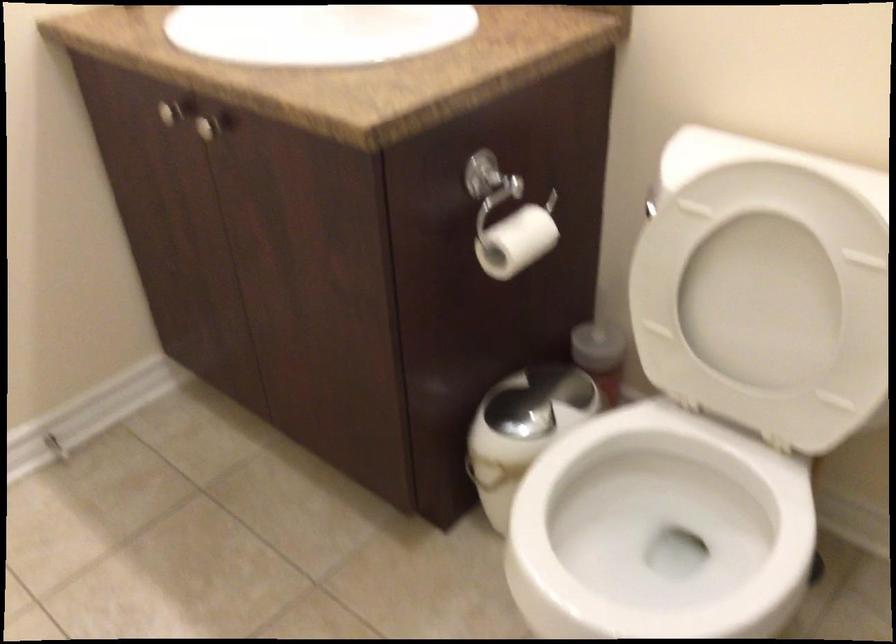
The image size is (896, 644). I want to click on white toilet seat, so click(660, 524).